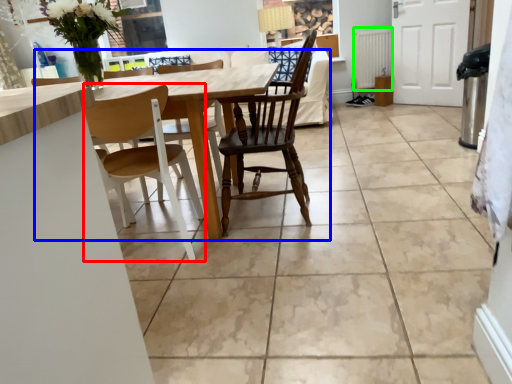
Question: Considering the real-world distances, which object is farthest from chair (highlighted by a red box)? kitchen & dining room table (highlighted by a blue box) or radiator (highlighted by a green box)?

Choices:
 (A) kitchen & dining room table
 (B) radiator

Answer: (B)